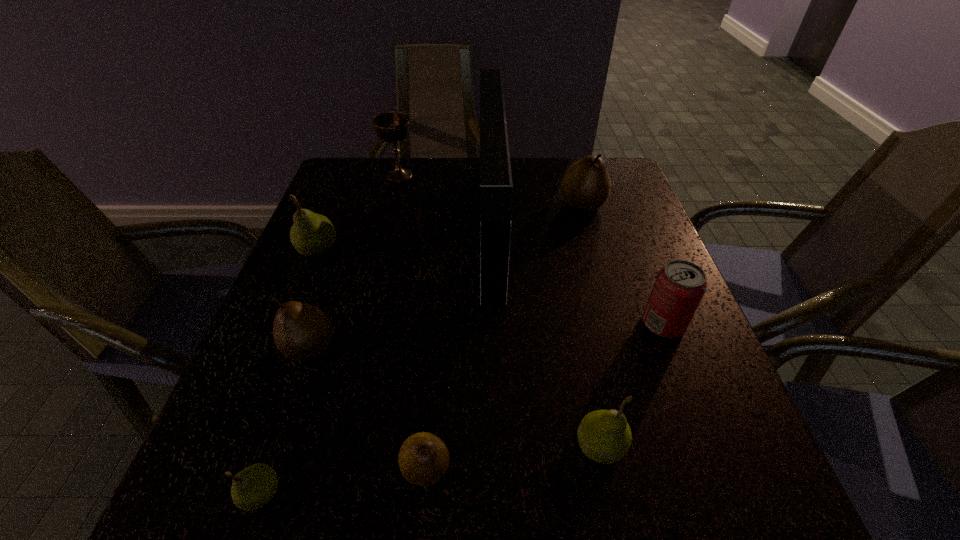
Identify the location of the rightmost green pear. The height and width of the screenshot is (540, 960). (604, 436).

Where is `the second nearest green pear`? The width and height of the screenshot is (960, 540). the second nearest green pear is located at coordinates (604, 436).

Identify the location of the smallest green pear. The height and width of the screenshot is (540, 960). (253, 487).

Find the location of a particular element. The image size is (960, 540). the second brown pear from left to right is located at coordinates (423, 459).

Image resolution: width=960 pixels, height=540 pixels. In order to click on the nearest brown pear in this screenshot , I will do `click(423, 459)`.

Image resolution: width=960 pixels, height=540 pixels. In order to click on free region located 0.060m on the front side of the black videotape in this screenshot , I will do `click(456, 229)`.

Image resolution: width=960 pixels, height=540 pixels. What are the coordinates of `free spot located 0.400m on the front side of the black videotape` in the screenshot? It's located at (318, 229).

In order to click on free space located on the front side of the black videotape in this screenshot , I will do `click(342, 229)`.

Image resolution: width=960 pixels, height=540 pixels. Find the location of `free spot located on the right of the chalice`. free spot located on the right of the chalice is located at coordinates (451, 175).

You are a GUI agent. You are given a task and a screenshot of the screen. Output one action in this format:
    pyautogui.click(x=<x>, y=<y>)
    Task: Click on the blank area located on the back of the biggest brown pear
    This screenshot has width=960, height=540.
    Given the screenshot: What is the action you would take?
    pyautogui.click(x=570, y=161)